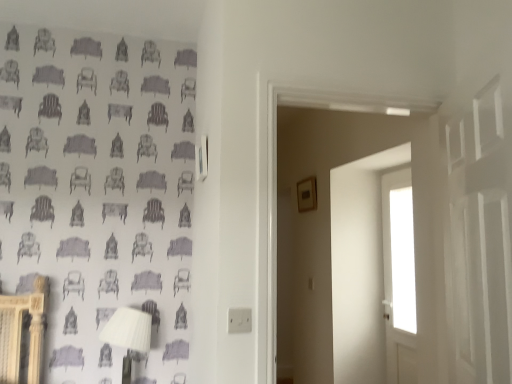
Based on the photo, measure the distance between point (393, 284) and camera.

A distance of 9.81 feet exists between point (393, 284) and camera.

This screenshot has width=512, height=384. Find the location of `transparent glass window at upper right, which is counted as the first window, starting from the top`. transparent glass window at upper right, which is counted as the first window, starting from the top is located at coordinates tap(402, 260).

What is the approximate height of transparent glass door at center, placed as the first window when sorted from bottom to top?

transparent glass door at center, placed as the first window when sorted from bottom to top, is 4.83 feet tall.

The width and height of the screenshot is (512, 384). I want to click on transparent glass window at upper right, which is counted as the 2th window, starting from the bottom, so click(x=402, y=260).

Between transparent glass door at center, the second window from the top, and transparent glass window at upper right, which is counted as the first window, starting from the top, which one is positioned behind?

transparent glass window at upper right, which is counted as the first window, starting from the top, is more distant.

From a real-world perspective, who is located higher, transparent glass door at center, placed as the first window when sorted from bottom to top, or transparent glass window at upper right, which is counted as the 2th window, starting from the bottom?

transparent glass window at upper right, which is counted as the 2th window, starting from the bottom, from a real-world perspective.

In the scene shown: Measure the distance between transparent glass door at center, placed as the first window when sorted from bottom to top, and transparent glass window at upper right, which is counted as the 2th window, starting from the bottom.

transparent glass door at center, placed as the first window when sorted from bottom to top, and transparent glass window at upper right, which is counted as the 2th window, starting from the bottom, are 0.60 inches apart from each other.

Is transparent glass door at center, the second window from the top, outside of white plastic table lamp at lower left?

Yes, transparent glass door at center, the second window from the top, is not within white plastic table lamp at lower left.

In the scene shown: Which point is more distant from viewer, (407,259) or (121,309)?

Positioned behind is point (407,259).

This screenshot has width=512, height=384. In order to click on the 2nd window counting from the right side of the white plastic table lamp at lower left in this screenshot , I will do `click(398, 251)`.

Does transparent glass door at center, the second window from the top, have a lesser width compared to white plastic table lamp at lower left?

Yes, transparent glass door at center, the second window from the top, is thinner than white plastic table lamp at lower left.

Based on the photo, is white plastic table lamp at lower left taller than transparent glass window at upper right, which is counted as the 2th window, starting from the bottom?

Incorrect, the height of white plastic table lamp at lower left is not larger of that of transparent glass window at upper right, which is counted as the 2th window, starting from the bottom.

Is point (106, 341) closer to viewer compared to point (396, 271)?

That is True.

You are a GUI agent. You are given a task and a screenshot of the screen. Output one action in this format:
    pyautogui.click(x=<x>, y=<y>)
    Task: Click on the window that is the 2nd object above the white plastic table lamp at lower left (from a real-world perspective)
    
    Given the screenshot: What is the action you would take?
    pyautogui.click(x=402, y=260)

Does point (127, 331) lie behind point (398, 262)?

No.

Does white plastic table lamp at lower left turn towards transparent glass door at center, the second window from the top?

No, white plastic table lamp at lower left does not turn towards transparent glass door at center, the second window from the top.

Is white plastic table lamp at lower left wider than transparent glass door at center, the second window from the top?

Indeed, white plastic table lamp at lower left has a greater width compared to transparent glass door at center, the second window from the top.

Who is shorter, white plastic table lamp at lower left or transparent glass door at center, placed as the first window when sorted from bottom to top?

white plastic table lamp at lower left.

Is point (402, 318) closer or farther from the camera than point (383, 278)?

Point (402, 318) appears to be closer to the viewer than point (383, 278).

From the image's perspective, would you say transparent glass window at upper right, which is counted as the first window, starting from the top, is shown under transparent glass door at center, the second window from the top?

Incorrect, from the image's perspective, transparent glass window at upper right, which is counted as the first window, starting from the top, is higher than transparent glass door at center, the second window from the top.

From a real-world perspective, is transparent glass window at upper right, which is counted as the first window, starting from the top, physically below transparent glass door at center, placed as the first window when sorted from bottom to top?

No.

Is the position of transparent glass window at upper right, which is counted as the first window, starting from the top, more distant than that of white plastic table lamp at lower left?

Yes, transparent glass window at upper right, which is counted as the first window, starting from the top, is further from the viewer.

Is white plastic table lamp at lower left completely or partially inside transparent glass window at upper right, which is counted as the first window, starting from the top?

That's incorrect, white plastic table lamp at lower left is not inside transparent glass window at upper right, which is counted as the first window, starting from the top.

Measure the distance from transparent glass window at upper right, which is counted as the first window, starting from the top, to white plastic table lamp at lower left.

The distance of transparent glass window at upper right, which is counted as the first window, starting from the top, from white plastic table lamp at lower left is 1.67 meters.

What's the angular difference between transparent glass window at upper right, which is counted as the 2th window, starting from the bottom, and white plastic table lamp at lower left's facing directions?

83.8 degrees.

Where is `window lying in front of the transparent glass window at upper right, which is counted as the 2th window, starting from the bottom`? window lying in front of the transparent glass window at upper right, which is counted as the 2th window, starting from the bottom is located at coordinates (398, 251).

Locate an element on the screen. This screenshot has height=384, width=512. the 1st window above the white plastic table lamp at lower left (from a real-world perspective) is located at coordinates (398, 251).

Estimate the real-world distances between objects in this image. Which object is closer to white plastic table lamp at lower left, transparent glass window at upper right, which is counted as the 2th window, starting from the bottom, or transparent glass door at center, the second window from the top?

transparent glass window at upper right, which is counted as the 2th window, starting from the bottom, is positioned closer to the anchor white plastic table lamp at lower left.

Looking at the image, which one is located closer to transparent glass window at upper right, which is counted as the first window, starting from the top, white plastic table lamp at lower left or transparent glass door at center, placed as the first window when sorted from bottom to top?

Among the two, transparent glass door at center, placed as the first window when sorted from bottom to top, is located nearer to transparent glass window at upper right, which is counted as the first window, starting from the top.

From the image, which object appears to be farther from white plastic table lamp at lower left, transparent glass door at center, placed as the first window when sorted from bottom to top, or transparent glass window at upper right, which is counted as the 2th window, starting from the bottom?

The object further to white plastic table lamp at lower left is transparent glass door at center, placed as the first window when sorted from bottom to top.

From the image, which object appears to be nearer to transparent glass door at center, the second window from the top, transparent glass window at upper right, which is counted as the 2th window, starting from the bottom, or white plastic table lamp at lower left?

Among the two, transparent glass window at upper right, which is counted as the 2th window, starting from the bottom, is located nearer to transparent glass door at center, the second window from the top.

Estimate the real-world distances between objects in this image. Which object is further from transparent glass window at upper right, which is counted as the first window, starting from the top, transparent glass door at center, placed as the first window when sorted from bottom to top, or white plastic table lamp at lower left?

The object further to transparent glass window at upper right, which is counted as the first window, starting from the top, is white plastic table lamp at lower left.

Based on their spatial positions, is white plastic table lamp at lower left or transparent glass window at upper right, which is counted as the first window, starting from the top, closer to transparent glass door at center, placed as the first window when sorted from bottom to top?

Based on the image, transparent glass window at upper right, which is counted as the first window, starting from the top, appears to be nearer to transparent glass door at center, placed as the first window when sorted from bottom to top.

This screenshot has height=384, width=512. I want to click on window between white plastic table lamp at lower left and transparent glass door at center, placed as the first window when sorted from bottom to top, from left to right, so click(x=402, y=260).